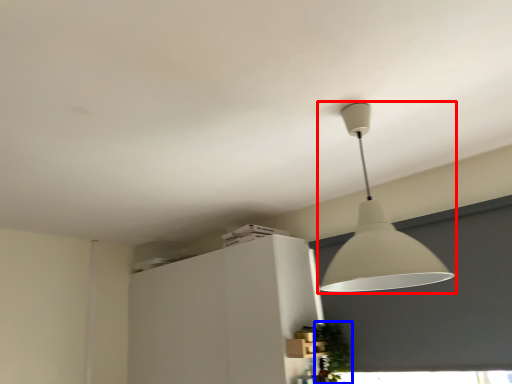
Question: Which object appears closest to the camera in this image, lamp (highlighted by a red box) or plant (highlighted by a blue box)?

Choices:
 (A) lamp
 (B) plant

Answer: (A)